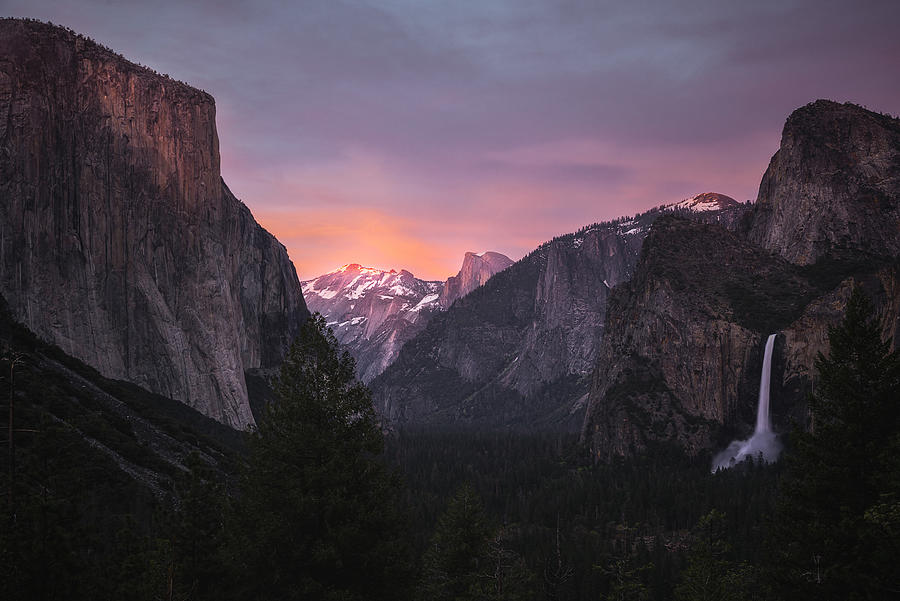
I want to click on art, so click(462, 43).